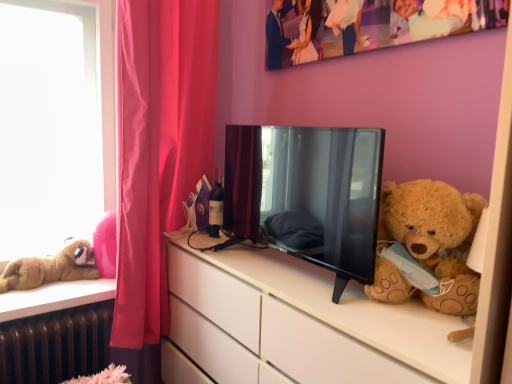
I want to click on vacant space to the left of fluffy brown teddy bear at right, which is the first teddy bear in right-to-left order, so click(353, 311).